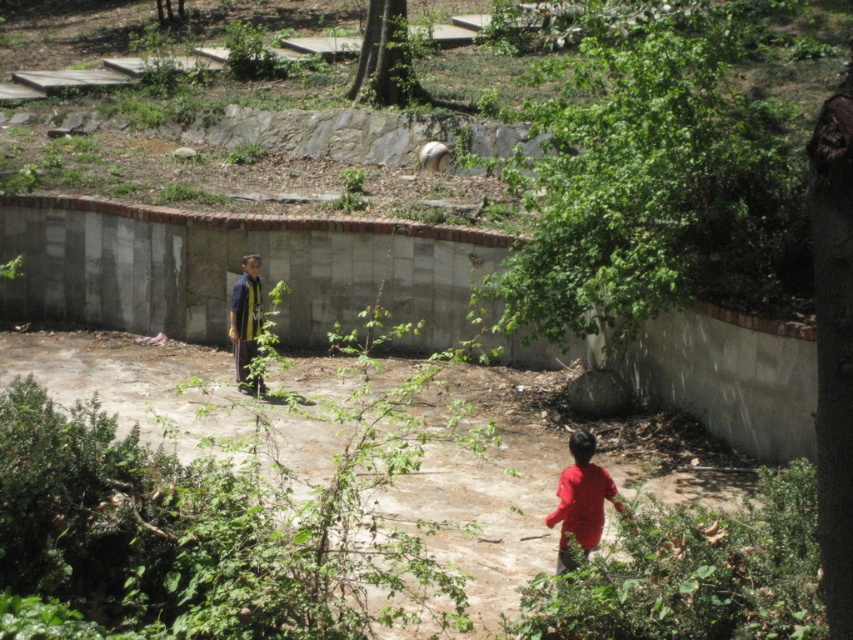
Question: Among these points, which one is nearest to the camera?

Choices:
 (A) (567, 564)
 (B) (244, 388)

Answer: (A)

Question: Which object appears closest to the camera in this image?

Choices:
 (A) red matte shirt at lower right
 (B) yellow jersey at center

Answer: (A)

Question: Does red matte shirt at lower right have a lesser width compared to yellow jersey at center?

Choices:
 (A) yes
 (B) no

Answer: (B)

Question: Does red matte shirt at lower right appear under yellow jersey at center?

Choices:
 (A) no
 (B) yes

Answer: (B)

Question: Does red matte shirt at lower right have a smaller size compared to yellow jersey at center?

Choices:
 (A) no
 (B) yes

Answer: (B)